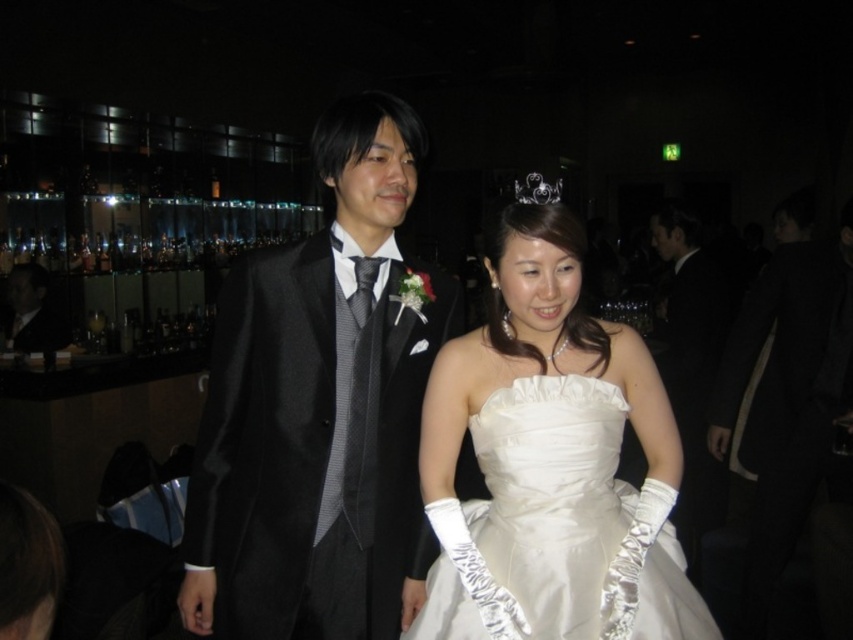
You are a photographer at a wedding reception. You need to position yourself so that the white satin dress at center and the black satin suit at left are both in frame. Which direction should you move to ensure both are visible?

You should move to the right to ensure both the white satin dress at center and the black satin suit at left are visible since the white satin dress at center is to the right of the black satin suit at left.

You are a photographer at the wedding reception. You need to position yourself so that the white satin dress at center and the black satin suit at left are both visible in your shot. Based on their positions, which one should be placed lower in the frame?

The white satin dress at center should be placed lower in the frame because it is located below the black satin suit at left.